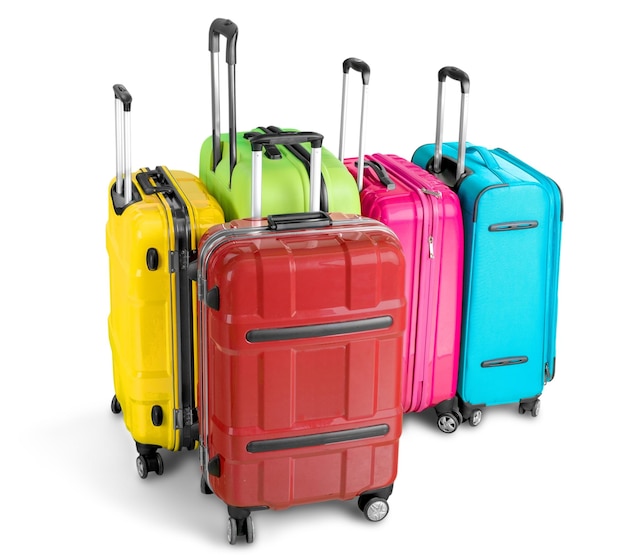
Image resolution: width=626 pixels, height=555 pixels. Identify the location of adjustable handles. (121, 92), (230, 74), (273, 134), (349, 64), (454, 80).